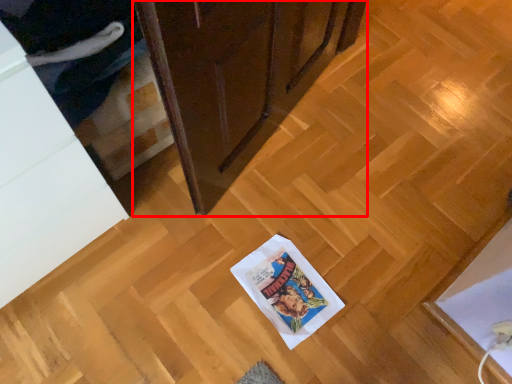
Question: From the image's perspective, where is cabinetry (annotated by the red box) located relative to cabinetry?

Choices:
 (A) above
 (B) below

Answer: (A)